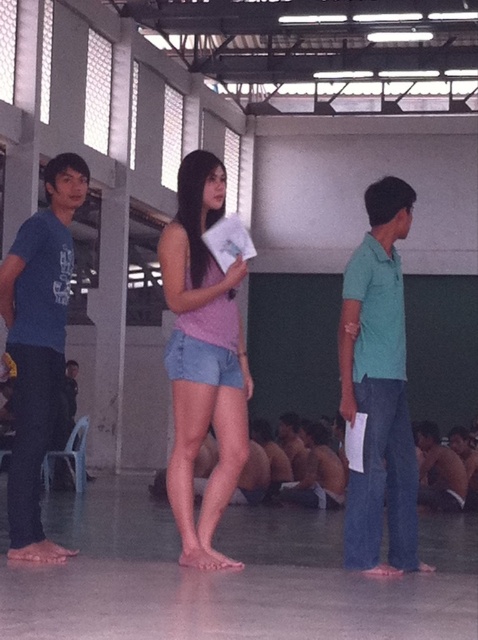
Question: Estimate the real-world distances between objects in this image. Which object is closer to the shiny metallic shirt at lower right?

Choices:
 (A) teal matte shirt at center
 (B) denim shorts at center
 (C) matte blue shirt at left

Answer: (A)

Question: Is matte blue shirt at left above shiny metallic shirt at lower right?

Choices:
 (A) no
 (B) yes

Answer: (B)

Question: Which object is closer to the camera taking this photo?

Choices:
 (A) denim shorts at center
 (B) shiny metallic shirt at lower right
 (C) matte blue shirt at left

Answer: (A)

Question: Which object is the closest to the denim shorts at center?

Choices:
 (A) matte blue shirt at left
 (B) teal matte shirt at center
 (C) shiny metallic shirt at lower right

Answer: (A)

Question: Is teal matte shirt at center thinner than matte blue shirt at left?

Choices:
 (A) no
 (B) yes

Answer: (A)

Question: Can you confirm if denim shorts at center is positioned to the left of shiny metallic shirt at lower right?

Choices:
 (A) no
 (B) yes

Answer: (B)